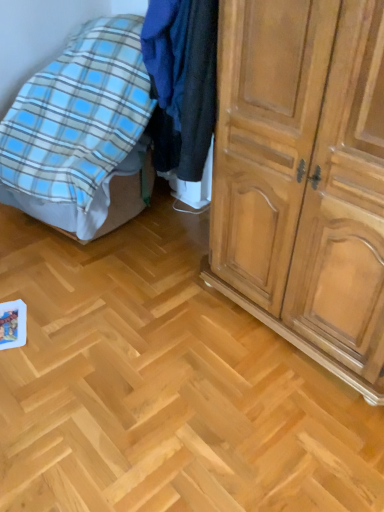
Where is `vacant space in front of light brown wooden cupboard at right`? This screenshot has width=384, height=512. vacant space in front of light brown wooden cupboard at right is located at coordinates (271, 428).